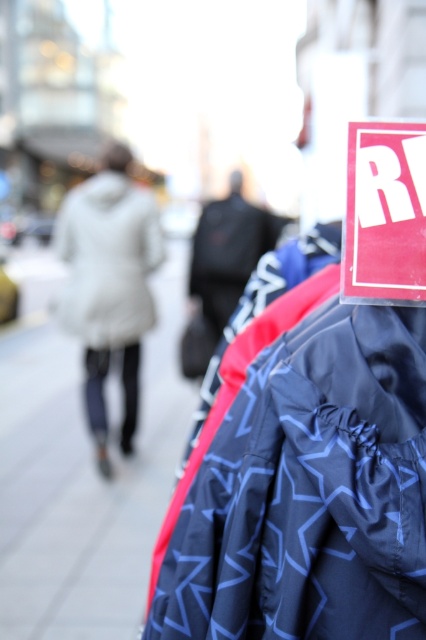
You are a delivery person trying to navigate through the street scene. You need to place a large package on the gray concrete pavement at lower left without blocking the white down coat at left. Is there enough space?

The gray concrete pavement at lower left is wider than the white down coat at left, so there is sufficient space to place the large package on the gray concrete pavement at lower left without blocking the white down coat at left.

You are standing in front of the clothing rack with jackets. There is a point marked at coordinate [302,484]. What object is located at that point?

The point at coordinate [302,484] marks the dark blue textured jacket at right.

You are a delivery person trying to place a package on the gray concrete pavement at lower left. The package is 1 meter tall. Can the dark blue textured jacket at right block the package from being placed there?

The dark blue textured jacket at right is shorter than the gray concrete pavement at lower left. Since the jacket is shorter than the pavement, it won